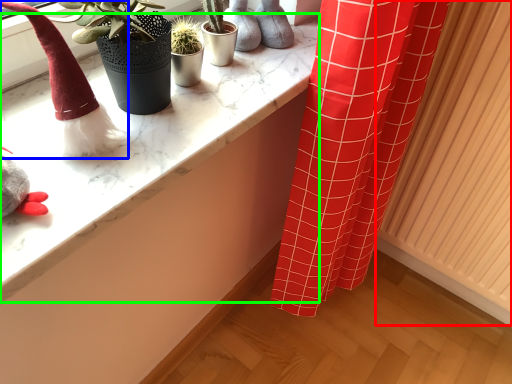
Question: Based on their relative distances, which object is farther from radiator (highlighted by a red box)? Choose from toy (highlighted by a blue box) and counter top (highlighted by a green box).

Choices:
 (A) toy
 (B) counter top

Answer: (A)